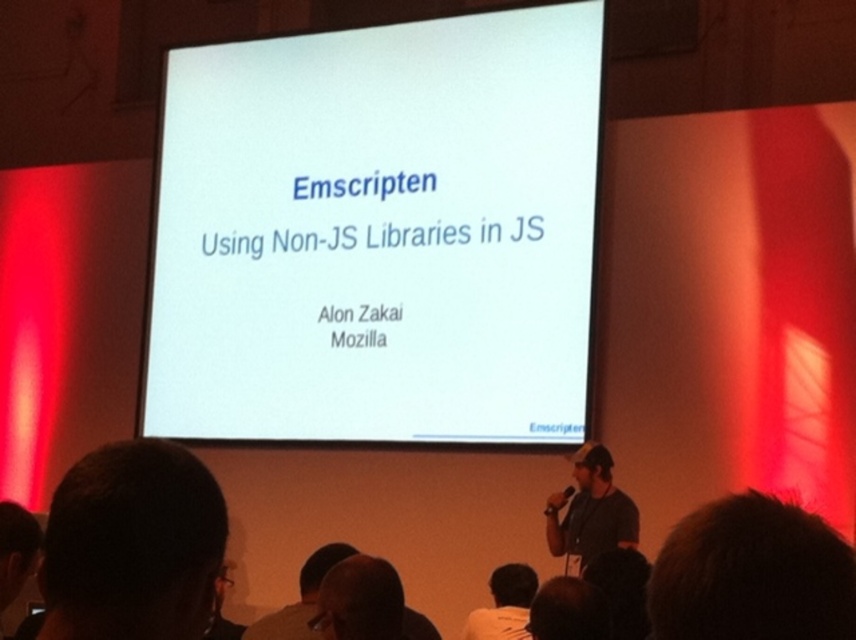
You are an attendee at the presentation. You notice the speaker is wearing two items at lower center. Which item is closer to you, the white shirt at lower center or the brown leather jacket at lower center?

The white shirt at lower center is closer to you because the brown leather jacket at lower center is behind it.

You are an attendee at this presentation and you want to describe the speaker to a colleague who hasn t arrived yet. Which object is positioned higher on the speaker s body, the brown hair at lower right or the gray fabric shirt at lower right?

The brown hair at lower right is located above the gray fabric shirt at lower right, so the brown hair at lower right is positioned higher on the speaker s body.

You are an attendee at the presentation and want to describe the speaker to a friend who hasn t arrived yet. Which item of clothing is wider on the speaker the white shirt at lower center or the brown leather jacket at lower center?

The brown leather jacket at lower center is wider than the white shirt at lower center.